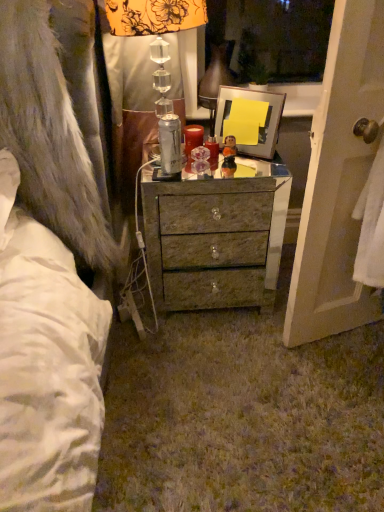
Question: Should I look upward or downward to see matte red candle at center?

Choices:
 (A) up
 (B) down

Answer: (A)

Question: Is metallic silver picture frame at center in front of matte red candle at center?

Choices:
 (A) no
 (B) yes

Answer: (B)

Question: Could you tell me if metallic silver picture frame at center is turned towards matte red candle at center?

Choices:
 (A) no
 (B) yes

Answer: (A)

Question: Considering the relative sizes of metallic silver picture frame at center and matte red candle at center in the image provided, is metallic silver picture frame at center wider than matte red candle at center?

Choices:
 (A) no
 (B) yes

Answer: (B)

Question: From the image's perspective, is metallic silver picture frame at center over matte red candle at center?

Choices:
 (A) yes
 (B) no

Answer: (A)

Question: Considering the relative positions of metallic silver picture frame at center and matte red candle at center in the image provided, is metallic silver picture frame at center behind matte red candle at center?

Choices:
 (A) yes
 (B) no

Answer: (B)

Question: From a real-world perspective, is metallic silver picture frame at center over matte red candle at center?

Choices:
 (A) yes
 (B) no

Answer: (A)

Question: Does silver metallic can at center lie in front of translucent glass figurine at center?

Choices:
 (A) yes
 (B) no

Answer: (A)

Question: Is silver metallic can at center looking in the opposite direction of translucent glass figurine at center?

Choices:
 (A) no
 (B) yes

Answer: (A)

Question: Is translucent glass figurine at center a part of silver metallic can at center?

Choices:
 (A) no
 (B) yes

Answer: (A)

Question: Does silver metallic can at center have a larger size compared to translucent glass figurine at center?

Choices:
 (A) no
 (B) yes

Answer: (B)

Question: Can you confirm if silver metallic can at center is shorter than translucent glass figurine at center?

Choices:
 (A) yes
 (B) no

Answer: (B)

Question: From the image's perspective, does silver metallic can at center appear lower than translucent glass figurine at center?

Choices:
 (A) yes
 (B) no

Answer: (A)

Question: Is matte red candle at center placed right next to white towel at right?

Choices:
 (A) yes
 (B) no

Answer: (B)